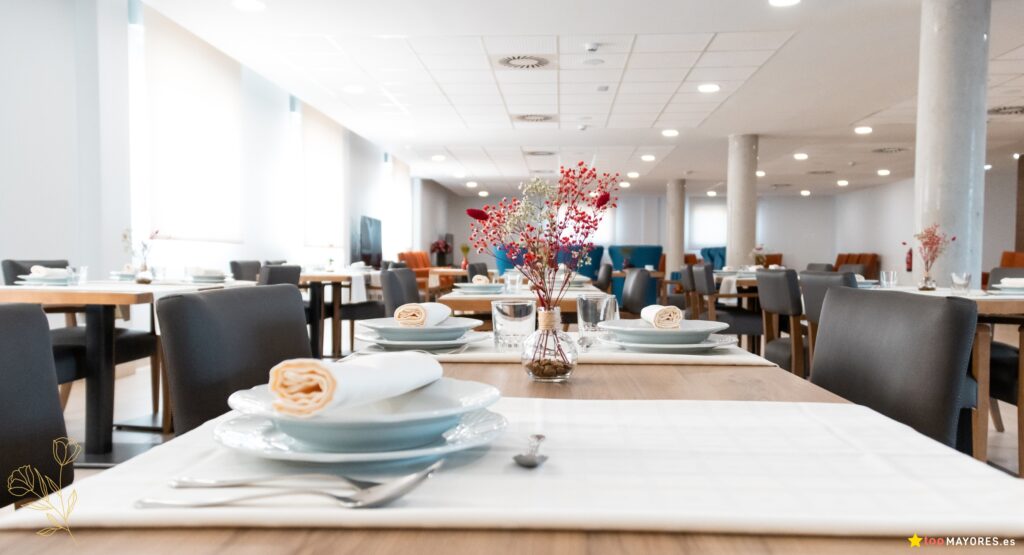
Where is `tables`? This screenshot has width=1024, height=555. tables is located at coordinates (680, 377), (1011, 305), (468, 299), (116, 286), (322, 271), (439, 268), (738, 285).